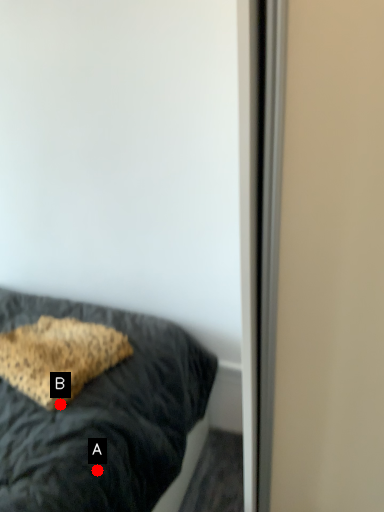
Question: Two points are circled on the image, labeled by A and B beside each circle. Which point is closer to the camera taking this photo?

Choices:
 (A) A is closer
 (B) B is closer

Answer: (A)